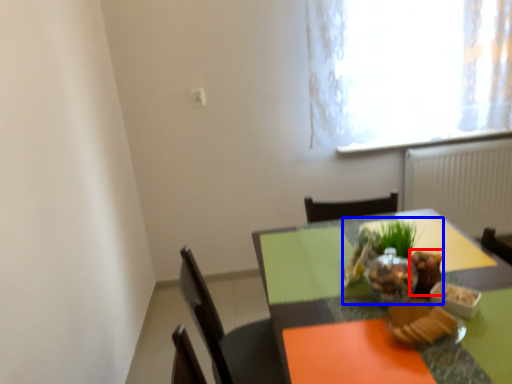
Question: Which of the following is the farthest to the observer, food (highlighted by a red box) or food (highlighted by a blue box)?

Choices:
 (A) food
 (B) food

Answer: (A)